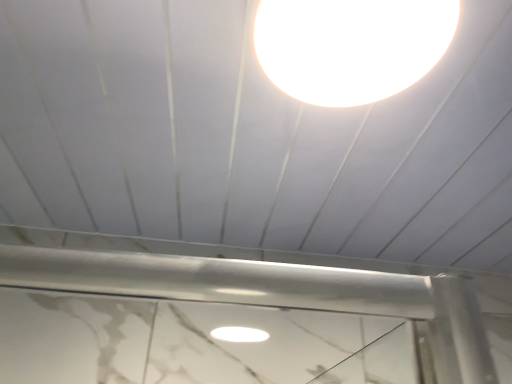
Describe the element at coordinates (351, 46) in the screenshot. I see `white glossy lamp at upper center` at that location.

The image size is (512, 384). I want to click on white glossy lamp at upper center, so click(x=351, y=46).

Identify the location of white glossy lamp at upper center. Image resolution: width=512 pixels, height=384 pixels. point(351,46).